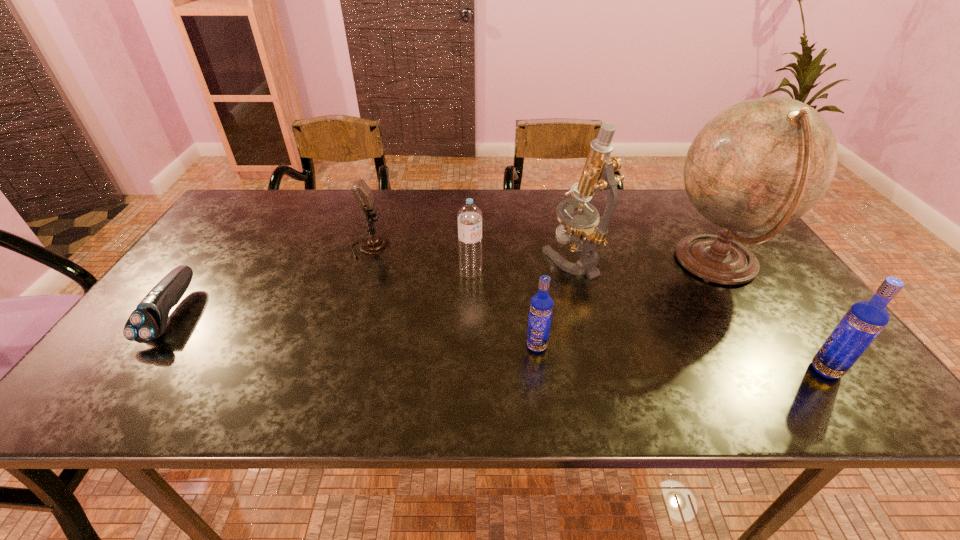
In the image, there is a desktop. Identify the location of vacant space at the near right corner. The width and height of the screenshot is (960, 540). (778, 354).

The height and width of the screenshot is (540, 960). Identify the location of unoccupied area between the fifth object from right to left and the nearer vodka. (x=648, y=321).

I want to click on vacant area between the microphone and the shortest object, so 271,280.

The image size is (960, 540). I want to click on free space between the shorter vodka and the globe, so click(627, 305).

Locate an element on the screen. The width and height of the screenshot is (960, 540). vacant space that is in between the second object from left to right and the water bottle is located at coordinates point(420,260).

You are a GUI agent. You are given a task and a screenshot of the screen. Output one action in this format:
    pyautogui.click(x=<x>, y=<y>)
    Task: Click on the free space between the leftmost object and the shorter vodka
    The height and width of the screenshot is (540, 960).
    Given the screenshot: What is the action you would take?
    pyautogui.click(x=354, y=329)

Where is `free spot between the microphone and the shortest object`? The image size is (960, 540). free spot between the microphone and the shortest object is located at coordinates (271, 280).

Where is `free space between the nearest object and the fourth object from left to right`? free space between the nearest object and the fourth object from left to right is located at coordinates (682, 358).

The height and width of the screenshot is (540, 960). Identify the location of free point between the fifth object from left to right and the electric shaver. (372, 286).

What are the coordinates of `free space between the fifth object from right to left and the microscope` in the screenshot? It's located at pos(521,266).